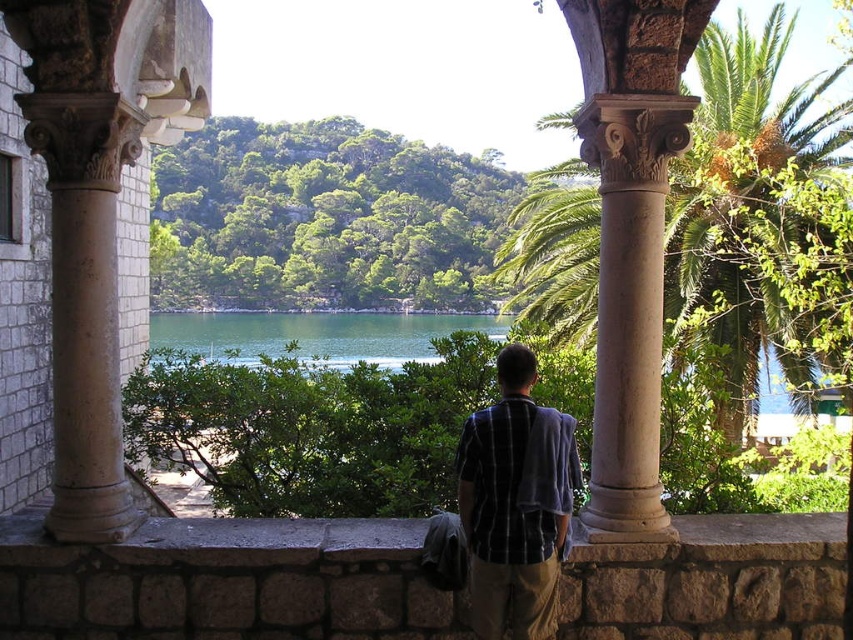
Which is above, stone ledge at center or plaid shirt at center?

plaid shirt at center

Which is behind, point (213, 595) or point (558, 499)?

Point (213, 595)

Is point (784, 566) closer to viewer compared to point (503, 396)?

No, (784, 566) is further to viewer.

This screenshot has width=853, height=640. Identify the location of stone ledge at center. (224, 582).

Which is above, stone ledge at center or beige stone column at left?

Positioned higher is beige stone column at left.

How distant is stone ledge at center from beige stone column at left?

stone ledge at center is 6.18 meters away from beige stone column at left.

At what (x,y) coordinates should I click in order to perform the action: click on stone ledge at center. Please return your answer as a coordinate pair (x, y). This screenshot has height=640, width=853. Looking at the image, I should click on (224, 582).

Locate an element on the screen. stone ledge at center is located at coordinates (224, 582).

Between point (61, 518) and point (518, 458), which one is positioned behind?

Point (61, 518)

Is point (120, 67) closer to camera compared to point (474, 436)?

No, it is behind (474, 436).

Locate an element on the screen. The height and width of the screenshot is (640, 853). beige stone column at left is located at coordinates (97, 209).

Where is `beige stone column at left`? beige stone column at left is located at coordinates point(97,209).